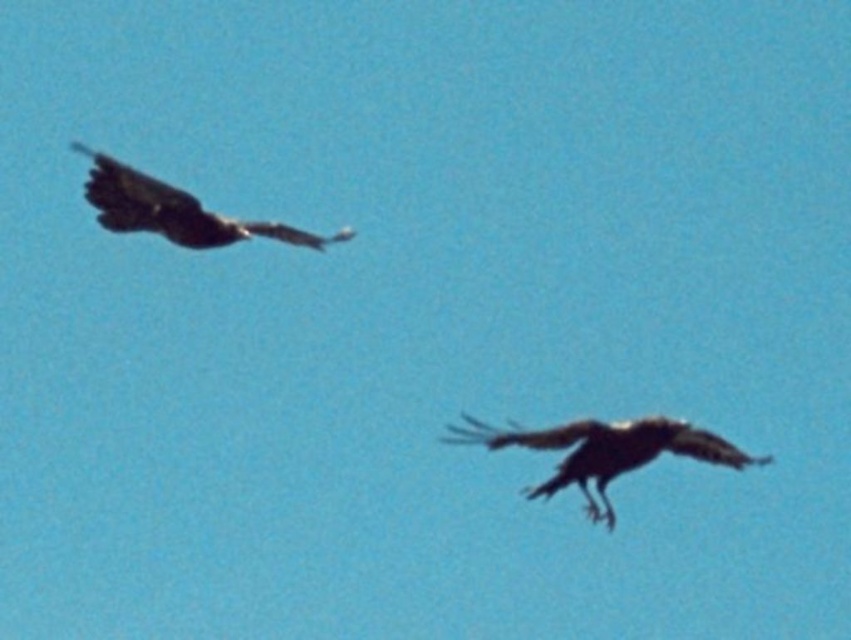
Question: Which point is closer to the camera taking this photo?

Choices:
 (A) (641, 424)
 (B) (123, 230)

Answer: (A)

Question: Does shiny black eagle at lower center appear under dark brown feathers at upper left?

Choices:
 (A) no
 (B) yes

Answer: (B)

Question: Among these points, which one is nearest to the camera?

Choices:
 (A) (580, 429)
 (B) (227, 232)

Answer: (A)

Question: Which of the following is the closest to the observer?

Choices:
 (A) (578, 433)
 (B) (181, 221)

Answer: (A)

Question: From the image, what is the correct spatial relationship of shiny black eagle at lower center in relation to dark brown feathers at upper left?

Choices:
 (A) left
 (B) right

Answer: (B)

Question: In this image, where is shiny black eagle at lower center located relative to dark brown feathers at upper left?

Choices:
 (A) right
 (B) left

Answer: (A)